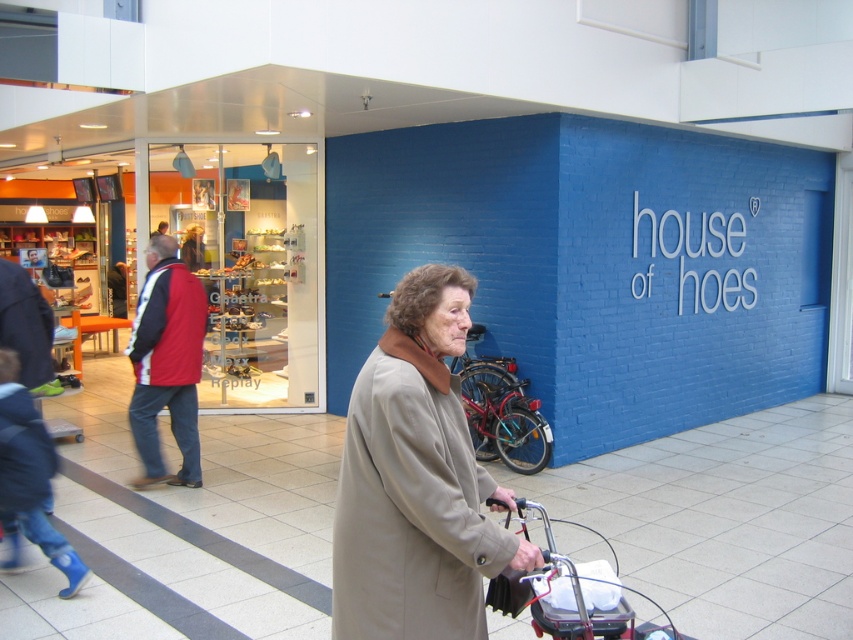
Based on the photo, is beige wool coat at center wider than red jacket at left?

Yes, beige wool coat at center is wider than red jacket at left.

Which is below, beige wool coat at center or red jacket at left?

beige wool coat at center is lower down.

Between point (460, 355) and point (140, 301), which one is positioned behind?

The point (140, 301) is more distant.

You are a GUI agent. You are given a task and a screenshot of the screen. Output one action in this format:
    pyautogui.click(x=<x>, y=<y>)
    Task: Click on the beige wool coat at center
    Image resolution: width=853 pixels, height=640 pixels.
    Given the screenshot: What is the action you would take?
    pyautogui.click(x=416, y=481)

Can you confirm if matte glass shoe display at left is smaller than red jacket at left?

No.

Is point (247, 394) in front of point (155, 428)?

No, it is not.

Find the location of a particular element. matte glass shoe display at left is located at coordinates (189, 257).

Measure the distance between beige wool coat at center and metallic silver baby carriage at lower center.

beige wool coat at center and metallic silver baby carriage at lower center are 15.55 inches apart from each other.

Measure the distance between point (x=509, y=552) and camera.

A distance of 2.36 meters exists between point (x=509, y=552) and camera.

You are a GUI agent. You are given a task and a screenshot of the screen. Output one action in this format:
    pyautogui.click(x=<x>, y=<y>)
    Task: Click on the beige wool coat at center
    
    Given the screenshot: What is the action you would take?
    pyautogui.click(x=416, y=481)